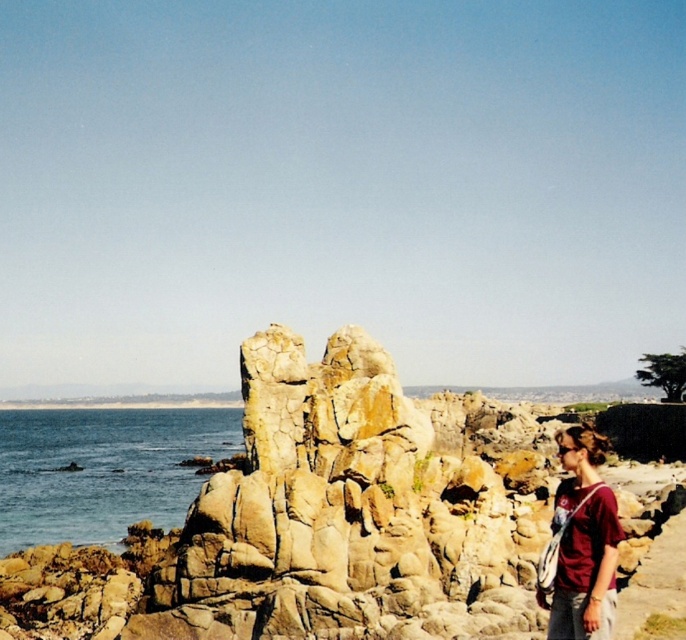
Question: Which of the following is the farthest from the observer?

Choices:
 (A) matte red shirt at lower right
 (B) blue water at left

Answer: (B)

Question: Which of the following is the closest to the observer?

Choices:
 (A) (600, 458)
 (B) (152, 440)

Answer: (A)

Question: In this image, where is blue water at left located relative to matte red shirt at lower right?

Choices:
 (A) left
 (B) right

Answer: (A)

Question: Is blue water at left smaller than matte red shirt at lower right?

Choices:
 (A) no
 (B) yes

Answer: (A)

Question: Can you confirm if blue water at left is thinner than matte red shirt at lower right?

Choices:
 (A) yes
 (B) no

Answer: (B)